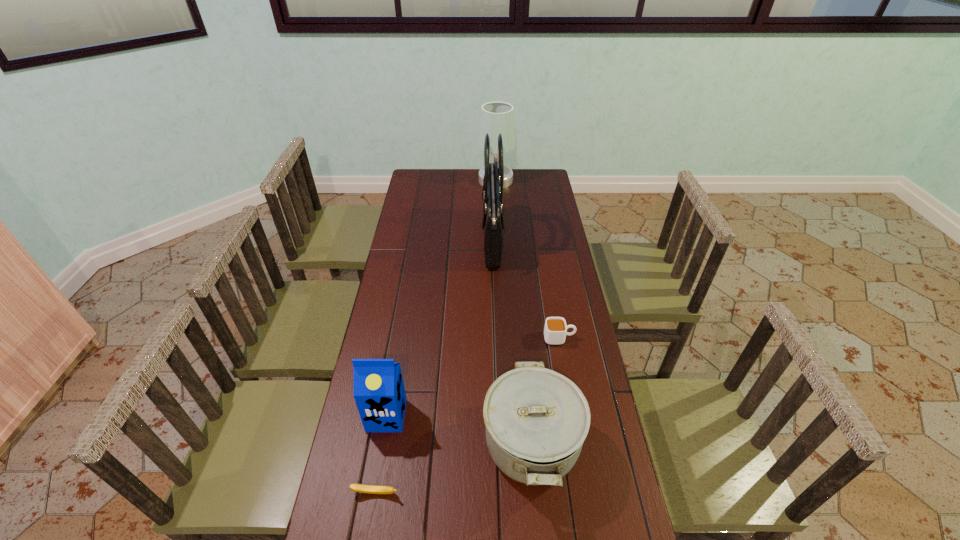
Find the location of a particular element. The width and height of the screenshot is (960, 540). the tallest object is located at coordinates (493, 180).

The height and width of the screenshot is (540, 960). I want to click on handbag, so click(493, 180).

The height and width of the screenshot is (540, 960). I want to click on the second tallest object, so coord(497,117).

I want to click on lampshade, so click(x=497, y=117).

The width and height of the screenshot is (960, 540). What are the coordinates of `carton` in the screenshot? It's located at (378, 389).

This screenshot has height=540, width=960. I want to click on the third shortest object, so click(536, 419).

Image resolution: width=960 pixels, height=540 pixels. In order to click on cup in this screenshot , I will do [555, 330].

Image resolution: width=960 pixels, height=540 pixels. What are the coordinates of `the fourth nearest object` in the screenshot? It's located at (555, 330).

Where is `banana`? This screenshot has width=960, height=540. banana is located at coordinates tap(371, 489).

The image size is (960, 540). Find the location of `vacant position located 0.130m with an open clasp on the front of the handbag`. vacant position located 0.130m with an open clasp on the front of the handbag is located at coordinates click(452, 240).